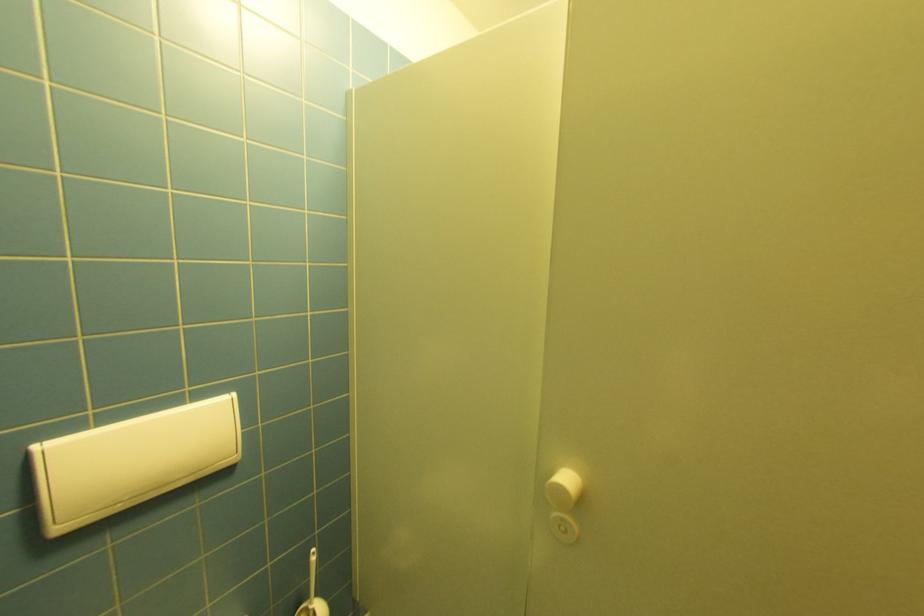
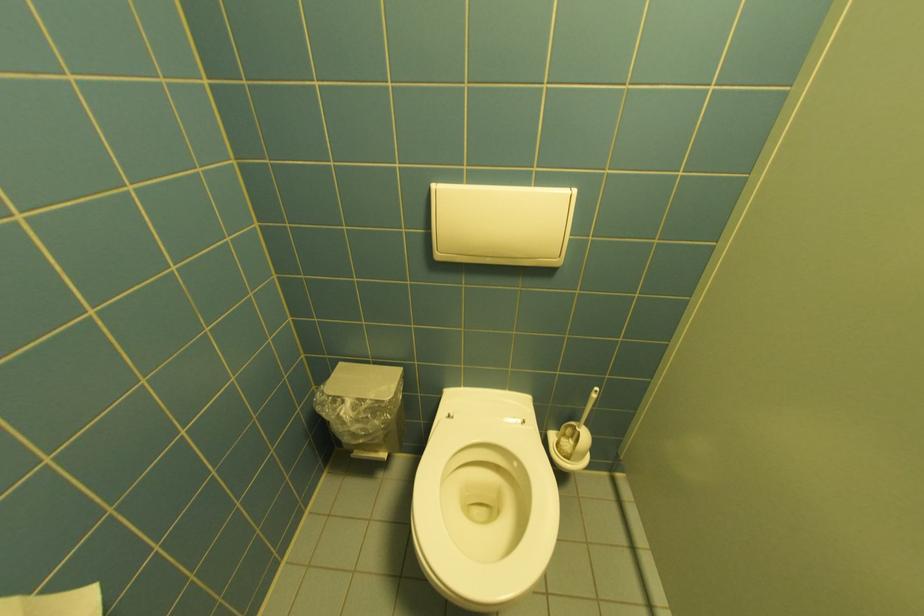
The first image is from the beginning of the video and the second image is from the end. How did the camera likely rotate when shooting the video?

The rotation direction of the camera is left-down.